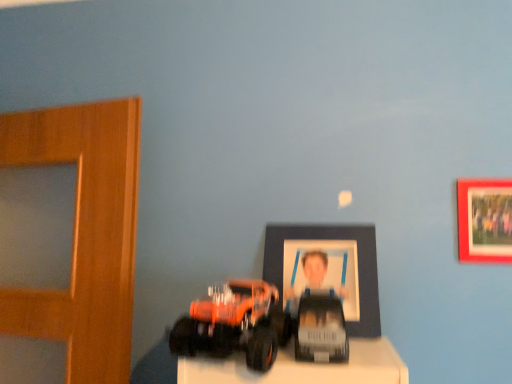
This screenshot has width=512, height=384. Identify the location of shiny metallic car at center, positioned as the 2th toy in left-to-right order. (x=321, y=328).

The width and height of the screenshot is (512, 384). What do you see at coordinates (321, 328) in the screenshot? I see `shiny metallic car at center, positioned as the 2th toy in left-to-right order` at bounding box center [321, 328].

Identify the location of matte plastic picture frame at center, which is the 2th picture frame from right to left. (332, 239).

Based on their sizes in the image, would you say shiny metallic car at center, the 1th toy in the right-to-left sequence, is bigger or smaller than matte plastic picture frame at center, which is the 2th picture frame from right to left?

Clearly, shiny metallic car at center, the 1th toy in the right-to-left sequence, is smaller in size than matte plastic picture frame at center, which is the 2th picture frame from right to left.

Which is more to the right, shiny metallic car at center, positioned as the 2th toy in left-to-right order, or matte plastic picture frame at center, which is the 2th picture frame from right to left?

matte plastic picture frame at center, which is the 2th picture frame from right to left.

Based on the photo, from a real-world perspective, is shiny metallic car at center, positioned as the 2th toy in left-to-right order, physically located above or below matte plastic picture frame at center, placed as the 1th picture frame when sorted from left to right?

shiny metallic car at center, positioned as the 2th toy in left-to-right order, is below matte plastic picture frame at center, placed as the 1th picture frame when sorted from left to right.

From the image's perspective, who appears lower, matte red picture frame at upper right, which is the 2th picture frame in left-to-right order, or orange matte truck at lower left, which is the 2th toy from right to left?

orange matte truck at lower left, which is the 2th toy from right to left, from the image's perspective.

From a real-world perspective, is matte red picture frame at upper right, which is the 2th picture frame in left-to-right order, physically located above or below orange matte truck at lower left, which is the 2th toy from right to left?

matte red picture frame at upper right, which is the 2th picture frame in left-to-right order, is situated higher than orange matte truck at lower left, which is the 2th toy from right to left, in the real world.

Is matte red picture frame at upper right, which is the first picture frame from right to left, not within orange matte truck at lower left, which ranks as the 1th toy in left-to-right order?

Yes, matte red picture frame at upper right, which is the first picture frame from right to left, is located beyond the bounds of orange matte truck at lower left, which ranks as the 1th toy in left-to-right order.

Between matte red picture frame at upper right, which is the 2th picture frame in left-to-right order, and orange matte truck at lower left, which is the 2th toy from right to left, which one appears on the left side from the viewer's perspective?

From the viewer's perspective, orange matte truck at lower left, which is the 2th toy from right to left, appears more on the left side.

From the image's perspective, which is above, shiny metallic car at center, the 1th toy in the right-to-left sequence, or orange matte truck at lower left, which ranks as the 1th toy in left-to-right order?

orange matte truck at lower left, which ranks as the 1th toy in left-to-right order, is shown above in the image.

Is shiny metallic car at center, the 1th toy in the right-to-left sequence, oriented towards orange matte truck at lower left, which ranks as the 1th toy in left-to-right order?

No, shiny metallic car at center, the 1th toy in the right-to-left sequence, is not oriented towards orange matte truck at lower left, which ranks as the 1th toy in left-to-right order.

Is shiny metallic car at center, the 1th toy in the right-to-left sequence, taller or shorter than orange matte truck at lower left, which is the 2th toy from right to left?

In the image, shiny metallic car at center, the 1th toy in the right-to-left sequence, appears to be shorter than orange matte truck at lower left, which is the 2th toy from right to left.

Are shiny metallic car at center, the 1th toy in the right-to-left sequence, and orange matte truck at lower left, which ranks as the 1th toy in left-to-right order, beside each other?

No, shiny metallic car at center, the 1th toy in the right-to-left sequence, is not beside orange matte truck at lower left, which ranks as the 1th toy in left-to-right order.

Is orange matte truck at lower left, which is the 2th toy from right to left, not close to shiny metallic car at center, the 1th toy in the right-to-left sequence?

orange matte truck at lower left, which is the 2th toy from right to left, is actually quite close to shiny metallic car at center, the 1th toy in the right-to-left sequence.

Which of these two, orange matte truck at lower left, which is the 2th toy from right to left, or shiny metallic car at center, positioned as the 2th toy in left-to-right order, is wider?

Wider between the two is orange matte truck at lower left, which is the 2th toy from right to left.

Which is nearer, (256, 345) or (295, 352)?

Point (256, 345)

Does orange matte truck at lower left, which is the 2th toy from right to left, have a smaller size compared to shiny metallic car at center, the 1th toy in the right-to-left sequence?

No, orange matte truck at lower left, which is the 2th toy from right to left, is not smaller than shiny metallic car at center, the 1th toy in the right-to-left sequence.

Is orange matte truck at lower left, which ranks as the 1th toy in left-to-right order, not within matte red picture frame at upper right, which is the 2th picture frame in left-to-right order?

Indeed, orange matte truck at lower left, which ranks as the 1th toy in left-to-right order, is completely outside matte red picture frame at upper right, which is the 2th picture frame in left-to-right order.

Who is bigger, orange matte truck at lower left, which is the 2th toy from right to left, or matte red picture frame at upper right, which is the first picture frame from right to left?

orange matte truck at lower left, which is the 2th toy from right to left, is bigger.

Considering the positions of objects orange matte truck at lower left, which is the 2th toy from right to left, and matte red picture frame at upper right, which is the 2th picture frame in left-to-right order, in the image provided, who is more to the left, orange matte truck at lower left, which is the 2th toy from right to left, or matte red picture frame at upper right, which is the 2th picture frame in left-to-right order,?

From the viewer's perspective, orange matte truck at lower left, which is the 2th toy from right to left, appears more on the left side.

In terms of height, does matte red picture frame at upper right, which is the first picture frame from right to left, look taller or shorter compared to matte plastic picture frame at center, which is the 2th picture frame from right to left?

Considering their sizes, matte red picture frame at upper right, which is the first picture frame from right to left, has less height than matte plastic picture frame at center, which is the 2th picture frame from right to left.

How much distance is there between matte red picture frame at upper right, which is the 2th picture frame in left-to-right order, and matte plastic picture frame at center, which is the 2th picture frame from right to left?

12.83 inches.

From a real-world perspective, is matte red picture frame at upper right, which is the 2th picture frame in left-to-right order, beneath matte plastic picture frame at center, which is the 2th picture frame from right to left?

No, from a real-world perspective, matte red picture frame at upper right, which is the 2th picture frame in left-to-right order, is not beneath matte plastic picture frame at center, which is the 2th picture frame from right to left.

This screenshot has height=384, width=512. Identify the location of picture frame below the matte red picture frame at upper right, which is the first picture frame from right to left (from a real-world perspective). (332, 239).

Which is closer to the camera, (347, 329) or (466, 189)?

The point (347, 329) is in front.

Does matte plastic picture frame at center, placed as the 1th picture frame when sorted from left to right, have a greater height compared to matte red picture frame at upper right, which is the 2th picture frame in left-to-right order?

Yes.

Is there a large distance between matte plastic picture frame at center, which is the 2th picture frame from right to left, and matte red picture frame at upper right, which is the first picture frame from right to left?

That's not correct — matte plastic picture frame at center, which is the 2th picture frame from right to left, is a little close to matte red picture frame at upper right, which is the first picture frame from right to left.

What are the coordinates of `the 1st picture frame above when counting from the shiny metallic car at center, the 1th toy in the right-to-left sequence (from the image's perspective)` in the screenshot? It's located at (332, 239).

The width and height of the screenshot is (512, 384). In order to click on the 2nd toy counting from the left side of the matte red picture frame at upper right, which is the 2th picture frame in left-to-right order in this screenshot , I will do [234, 324].

From the image, which object appears to be nearer to shiny metallic car at center, positioned as the 2th toy in left-to-right order, orange matte truck at lower left, which is the 2th toy from right to left, or matte red picture frame at upper right, which is the first picture frame from right to left?

orange matte truck at lower left, which is the 2th toy from right to left, is closer to shiny metallic car at center, positioned as the 2th toy in left-to-right order.

When comparing their distances from matte plastic picture frame at center, which is the 2th picture frame from right to left, does orange matte truck at lower left, which ranks as the 1th toy in left-to-right order, or matte red picture frame at upper right, which is the 2th picture frame in left-to-right order, seem further?

Based on the image, matte red picture frame at upper right, which is the 2th picture frame in left-to-right order, appears to be further to matte plastic picture frame at center, which is the 2th picture frame from right to left.

Which object lies further to the anchor point orange matte truck at lower left, which is the 2th toy from right to left, matte red picture frame at upper right, which is the first picture frame from right to left, or shiny metallic car at center, the 1th toy in the right-to-left sequence?

The object further to orange matte truck at lower left, which is the 2th toy from right to left, is matte red picture frame at upper right, which is the first picture frame from right to left.

Estimate the real-world distances between objects in this image. Which object is closer to orange matte truck at lower left, which is the 2th toy from right to left, matte red picture frame at upper right, which is the 2th picture frame in left-to-right order, or matte plastic picture frame at center, which is the 2th picture frame from right to left?

matte plastic picture frame at center, which is the 2th picture frame from right to left, lies closer to orange matte truck at lower left, which is the 2th toy from right to left, than the other object.

Looking at the image, which one is located closer to matte red picture frame at upper right, which is the 2th picture frame in left-to-right order, matte plastic picture frame at center, placed as the 1th picture frame when sorted from left to right, or orange matte truck at lower left, which is the 2th toy from right to left?

matte plastic picture frame at center, placed as the 1th picture frame when sorted from left to right, lies closer to matte red picture frame at upper right, which is the 2th picture frame in left-to-right order, than the other object.

From the image, which object appears to be nearer to matte plastic picture frame at center, which is the 2th picture frame from right to left, shiny metallic car at center, the 1th toy in the right-to-left sequence, or matte red picture frame at upper right, which is the first picture frame from right to left?

shiny metallic car at center, the 1th toy in the right-to-left sequence, is closer to matte plastic picture frame at center, which is the 2th picture frame from right to left.

Looking at the image, which one is located closer to matte red picture frame at upper right, which is the first picture frame from right to left, matte plastic picture frame at center, which is the 2th picture frame from right to left, or shiny metallic car at center, the 1th toy in the right-to-left sequence?

matte plastic picture frame at center, which is the 2th picture frame from right to left, is positioned closer to the anchor matte red picture frame at upper right, which is the first picture frame from right to left.

Estimate the real-world distances between objects in this image. Which object is closer to shiny metallic car at center, positioned as the 2th toy in left-to-right order, matte plastic picture frame at center, which is the 2th picture frame from right to left, or orange matte truck at lower left, which is the 2th toy from right to left?

Based on the image, orange matte truck at lower left, which is the 2th toy from right to left, appears to be nearer to shiny metallic car at center, positioned as the 2th toy in left-to-right order.

In order to click on picture frame between orange matte truck at lower left, which ranks as the 1th toy in left-to-right order, and matte red picture frame at upper right, which is the first picture frame from right to left in this screenshot , I will do `click(332, 239)`.

Locate an element on the screen. picture frame situated between shiny metallic car at center, positioned as the 2th toy in left-to-right order, and matte red picture frame at upper right, which is the first picture frame from right to left, from left to right is located at coordinates (332, 239).

Identify the location of toy positioned between orange matte truck at lower left, which is the 2th toy from right to left, and matte plastic picture frame at center, which is the 2th picture frame from right to left, from near to far. (321, 328).

The image size is (512, 384). What are the coordinates of `toy between orange matte truck at lower left, which ranks as the 1th toy in left-to-right order, and matte red picture frame at upper right, which is the 2th picture frame in left-to-right order, from left to right` in the screenshot? It's located at (321, 328).